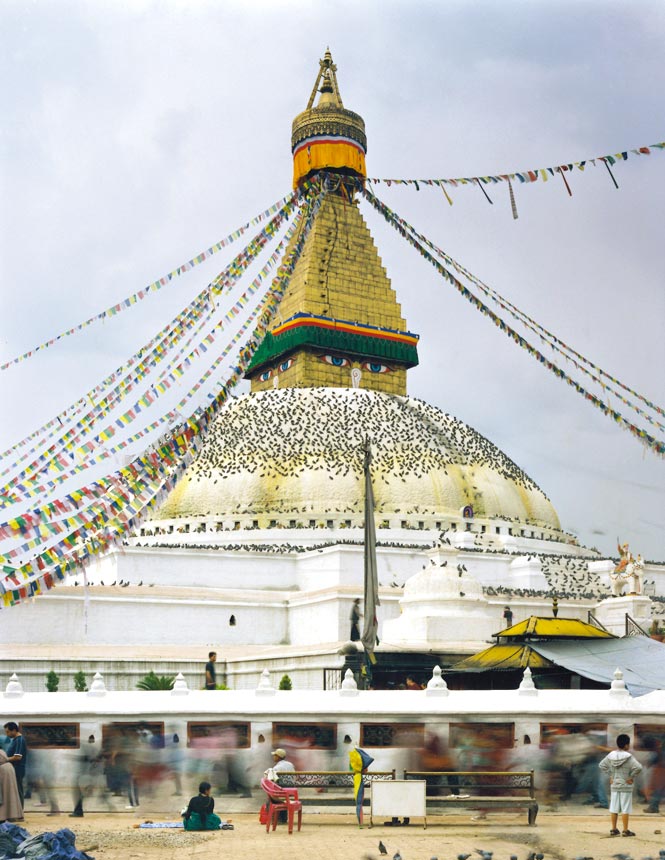
Where is `statue`? statue is located at coordinates (626, 570).